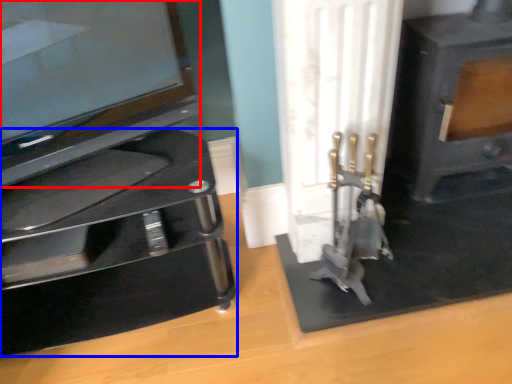
Question: Which object is further to the camera taking this photo, television (highlighted by a red box) or furniture (highlighted by a blue box)?

Choices:
 (A) television
 (B) furniture

Answer: (B)